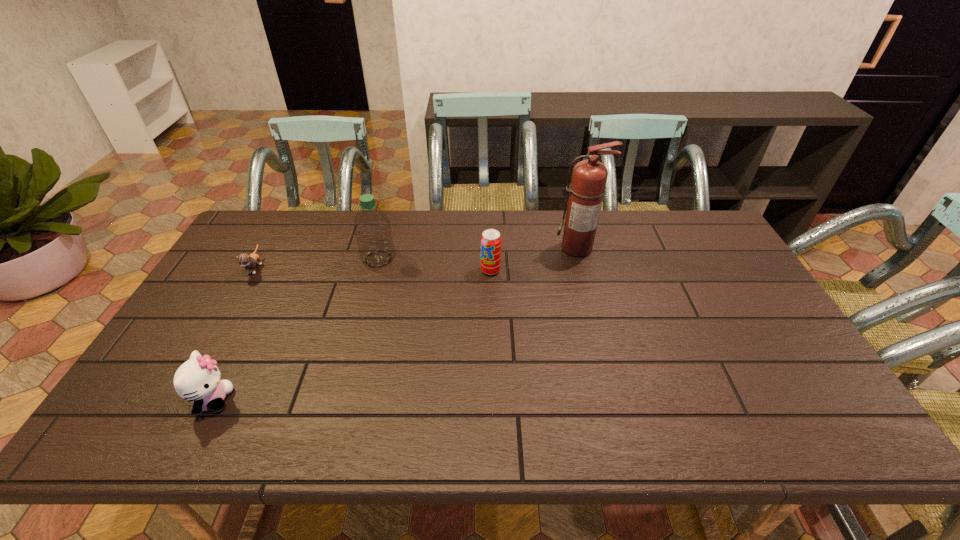
The image size is (960, 540). Identify the location of vacant space at the right edge of the desktop. (748, 313).

The image size is (960, 540). In the image, there is a desktop. Identify the location of blank space at the far right corner. (716, 232).

The image size is (960, 540). What are the coordinates of `free spot between the third object from left to right and the second object from left to right` in the screenshot? It's located at (296, 329).

Locate an element on the screen. This screenshot has width=960, height=540. unoccupied position between the soda can and the right kitten is located at coordinates (351, 335).

Identify the location of free space between the rightmost object and the soda can. (534, 259).

Where is `free space between the nearest object and the rightmost object`? free space between the nearest object and the rightmost object is located at coordinates (396, 324).

Locate an element on the screen. vacant space in between the second object from right to left and the left kitten is located at coordinates (372, 269).

Find the location of a particular element. The image size is (960, 540). vacant space that is in between the taller kitten and the second tallest object is located at coordinates (296, 329).

The width and height of the screenshot is (960, 540). Identify the location of vacant space that is in between the rightmost object and the soda can. (534, 259).

I want to click on free space between the second object from right to left and the water bottle, so click(435, 265).